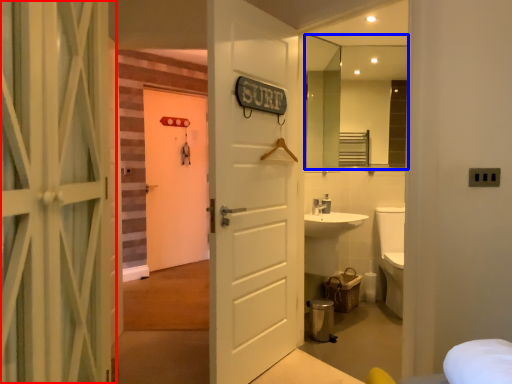
Question: Which object is closer to the camera taking this photo, door (highlighted by a red box) or mirror (highlighted by a blue box)?

Choices:
 (A) door
 (B) mirror

Answer: (A)